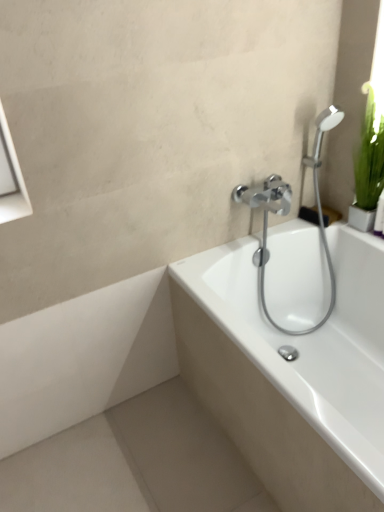
What do you see at coordinates (289, 210) in the screenshot?
I see `chrome metallic showerhead at upper right` at bounding box center [289, 210].

This screenshot has height=512, width=384. In order to click on chrome metallic showerhead at upper right in this screenshot , I will do `click(289, 210)`.

What is the approximate width of white glossy bathtub at center?

30.79 inches.

Measure the distance between point [234,195] and camera.

A distance of 5.29 feet exists between point [234,195] and camera.

The height and width of the screenshot is (512, 384). What do you see at coordinates (291, 374) in the screenshot?
I see `white glossy bathtub at center` at bounding box center [291, 374].

The image size is (384, 512). Find the location of `white glossy bathtub at center`. white glossy bathtub at center is located at coordinates (291, 374).

This screenshot has width=384, height=512. I want to click on chrome metallic showerhead at upper right, so click(289, 210).

Is chrome metallic showerhead at upper right to the left or to the right of white glossy bathtub at center in the image?

chrome metallic showerhead at upper right is to the left of white glossy bathtub at center.

Which object is further away from the camera, chrome metallic showerhead at upper right or white glossy bathtub at center?

chrome metallic showerhead at upper right is further from the camera.

Is point (277, 193) behind point (321, 247)?

No, it is in front of (321, 247).

From the picture: From the image's perspective, who appears lower, chrome metallic showerhead at upper right or white glossy bathtub at center?

white glossy bathtub at center.

From a real-world perspective, is chrome metallic showerhead at upper right over white glossy bathtub at center?

Correct, in the physical world, chrome metallic showerhead at upper right is higher than white glossy bathtub at center.

Can you confirm if chrome metallic showerhead at upper right is thinner than white glossy bathtub at center?

Yes.

Considering the relative sizes of chrome metallic showerhead at upper right and white glossy bathtub at center in the image provided, is chrome metallic showerhead at upper right shorter than white glossy bathtub at center?

No.

Looking at the image, does chrome metallic showerhead at upper right seem bigger or smaller compared to white glossy bathtub at center?

In the image, chrome metallic showerhead at upper right appears to be smaller than white glossy bathtub at center.

Is white glossy bathtub at center surrounded by chrome metallic showerhead at upper right?

Actually, white glossy bathtub at center is outside chrome metallic showerhead at upper right.

Is chrome metallic showerhead at upper right far from white glossy bathtub at center?

Actually, chrome metallic showerhead at upper right and white glossy bathtub at center are a little close together.

Is chrome metallic showerhead at upper right facing away from white glossy bathtub at center?

No, chrome metallic showerhead at upper right's orientation is not away from white glossy bathtub at center.

What's the angular difference between chrome metallic showerhead at upper right and white glossy bathtub at center's facing directions?

They differ by 89.7 degrees in their facing directions.

Where is `plumbing fixture lying on the left of white glossy bathtub at center`? The width and height of the screenshot is (384, 512). plumbing fixture lying on the left of white glossy bathtub at center is located at coordinates (289, 210).

Can you confirm if white glossy bathtub at center is positioned to the right of chrome metallic showerhead at upper right?

Yes, white glossy bathtub at center is to the right of chrome metallic showerhead at upper right.

Considering the relative positions of white glossy bathtub at center and chrome metallic showerhead at upper right in the image provided, is white glossy bathtub at center in front of chrome metallic showerhead at upper right?

Yes, white glossy bathtub at center is closer to the camera.

Which point is more forward, [375,277] or [273,182]?

The point [273,182] is in front.

From the image's perspective, does white glossy bathtub at center appear higher than chrome metallic showerhead at upper right?

No, from the image's perspective, white glossy bathtub at center is not on top of chrome metallic showerhead at upper right.

From a real-world perspective, is white glossy bathtub at center below chrome metallic showerhead at upper right?

Yes.

Is white glossy bathtub at center wider or thinner than chrome metallic showerhead at upper right?

In the image, white glossy bathtub at center appears to be wider than chrome metallic showerhead at upper right.

Is white glossy bathtub at center taller than chrome metallic showerhead at upper right?

No.

Who is smaller, white glossy bathtub at center or chrome metallic showerhead at upper right?

chrome metallic showerhead at upper right is smaller.

Which is correct: white glossy bathtub at center is inside chrome metallic showerhead at upper right, or outside of it?

→ white glossy bathtub at center is not inside chrome metallic showerhead at upper right, it's outside.

Does white glossy bathtub at center touch chrome metallic showerhead at upper right?

They are not placed beside each other.

Is white glossy bathtub at center oriented away from chrome metallic showerhead at upper right?

That's not correct — white glossy bathtub at center is not looking away from chrome metallic showerhead at upper right.

Find the location of a particular element. Image resolution: width=384 pixels, height=512 pixels. plumbing fixture above the white glossy bathtub at center (from the image's perspective) is located at coordinates (289, 210).

This screenshot has width=384, height=512. I want to click on plumbing fixture behind the white glossy bathtub at center, so click(x=289, y=210).

Identify the location of bathtub below the chrome metallic showerhead at upper right (from the image's perspective). (291, 374).